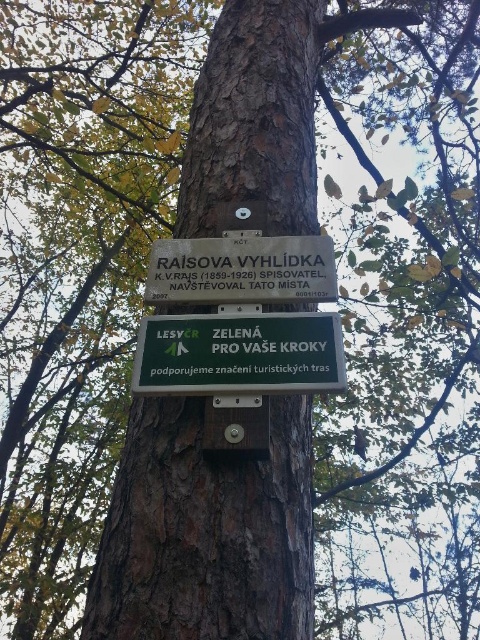
Does point (169, 316) come closer to viewer compared to point (253, 256)?

That is True.

Looking at this image, is green matte sign at center smaller than white wooden sign at center?

Yes.

Who is more distant from viewer, (301, 344) or (153, 262)?

The point (153, 262) is behind.

At what (x,y) coordinates should I click in order to perform the action: click on green matte sign at center. Please return your answer as a coordinate pair (x, y). This screenshot has width=480, height=640. Looking at the image, I should click on (239, 355).